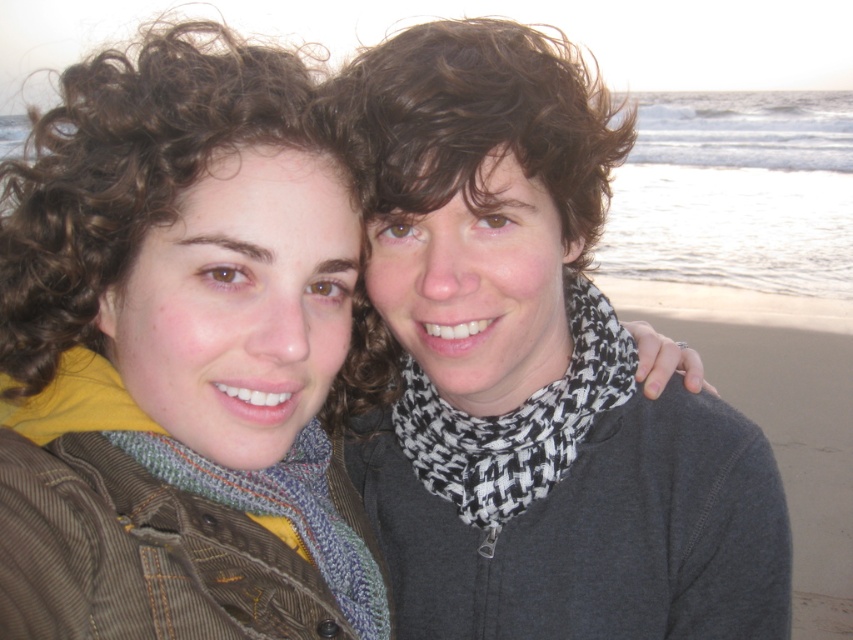
You are a photographer trying to capture both the knitted scarf at center and the knitted wool scarf at center in a single frame. Given that your camera can only focus on objects within a 1.5 meter width, will both scarves fit in the frame?

The knitted scarf at center is wider than the knitted wool scarf at center. Since the camera can focus on objects within a 1.5 meter width, both scarves can fit in the frame as long as their combined width does not exceed 1.5 meters. However, the exact fit depends on their individual widths, which are not provided here.

You are a photographer trying to capture the two points in the image. Which point, point (62, 568) or point (497, 497), is positioned closer to the camera?

Point (62, 568) is closer to the viewer than point (497, 497).